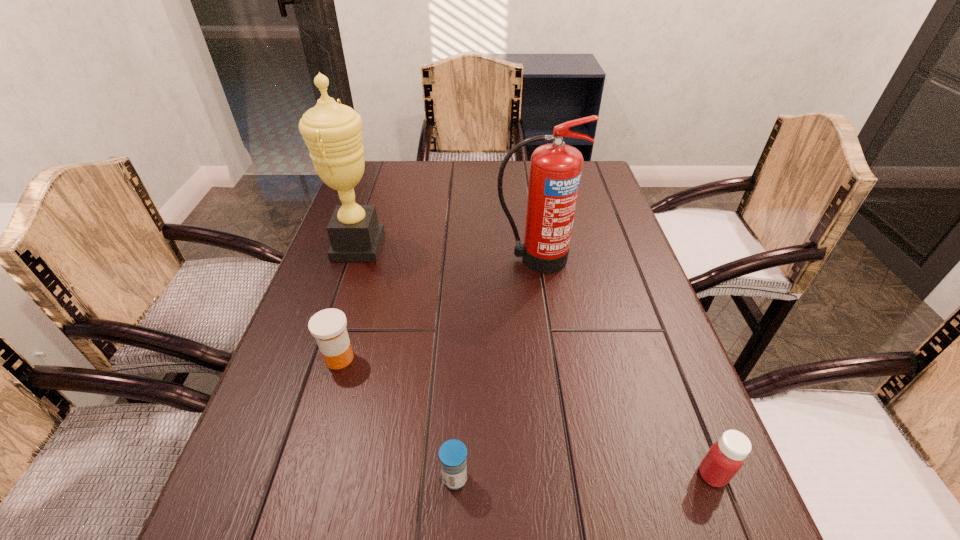
You are a GUI agent. You are given a task and a screenshot of the screen. Output one action in this format:
    pyautogui.click(x=<x>, y=<y>)
    Task: Click on the third closest object to the rightmost medicine
    
    Given the screenshot: What is the action you would take?
    pyautogui.click(x=328, y=326)

Identify which medicine is located as the second nearest to the rightmost medicine. Please provide its 2D coordinates. Your answer should be formatted as a tuple, i.e. [(x, y)], where the tuple contains the x and y coordinates of a point satisfying the conditions above.

[(328, 326)]

Identify which medicine is the second nearest to the rightmost object. Please provide its 2D coordinates. Your answer should be formatted as a tuple, i.e. [(x, y)], where the tuple contains the x and y coordinates of a point satisfying the conditions above.

[(328, 326)]

The height and width of the screenshot is (540, 960). Identify the location of vacant region that satisfies the following two spatial constraints: 1. on the label of the rightmost medicine; 2. on the left side of the leftmost medicine. [304, 475].

Where is `free space in the image that satisfies the following two spatial constraints: 1. on the surface of the fourth object from left to right; 2. on the label of the farthest medicine`? The height and width of the screenshot is (540, 960). free space in the image that satisfies the following two spatial constraints: 1. on the surface of the fourth object from left to right; 2. on the label of the farthest medicine is located at coordinates (549, 358).

Image resolution: width=960 pixels, height=540 pixels. I want to click on vacant space that satisfies the following two spatial constraints: 1. on the label of the rightmost medicine; 2. on the right side of the farthest medicine, so click(x=304, y=475).

Image resolution: width=960 pixels, height=540 pixels. In order to click on vacant space that satisfies the following two spatial constraints: 1. on the surface of the rightmost medicine; 2. on the left side of the fourth object from left to right in this screenshot , I will do `click(565, 475)`.

At what (x,y) coordinates should I click in order to perform the action: click on free space that satisfies the following two spatial constraints: 1. at the front of the trophy cup with handles; 2. on the left side of the rightmost medicine. Please return your answer as a coordinate pair (x, y). Image resolution: width=960 pixels, height=540 pixels. Looking at the image, I should click on (283, 475).

Where is `blank area in the image that satisfies the following two spatial constraints: 1. on the surface of the fourth object from left to right; 2. on the label of the third nearest object`? Image resolution: width=960 pixels, height=540 pixels. blank area in the image that satisfies the following two spatial constraints: 1. on the surface of the fourth object from left to right; 2. on the label of the third nearest object is located at coordinates (549, 358).

This screenshot has height=540, width=960. I want to click on free space that satisfies the following two spatial constraints: 1. on the label of the shortest medicine; 2. on the right side of the third nearest object, so click(x=303, y=478).